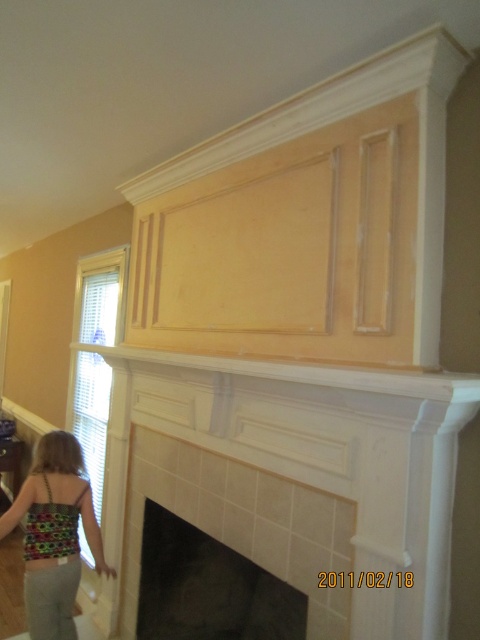
Between black glass fireplace at center and multicolored fabric dress at lower left, which one is positioned lower?

black glass fireplace at center is below.

How much distance is there between black glass fireplace at center and multicolored fabric dress at lower left?

A distance of 18.41 inches exists between black glass fireplace at center and multicolored fabric dress at lower left.

Does point (259, 637) lie behind point (41, 593)?

Yes, point (259, 637) is farther from viewer.

This screenshot has width=480, height=640. In order to click on black glass fireplace at center in this screenshot , I will do `click(207, 588)`.